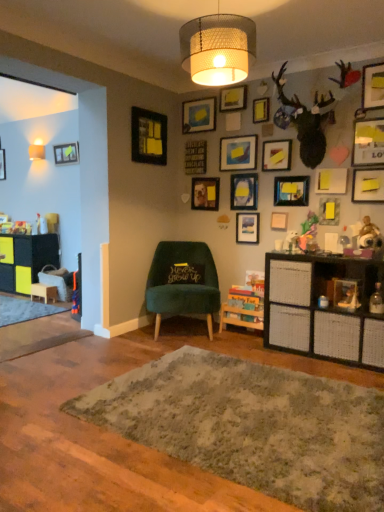
Question: Is textured gray rug at center far from matte wooden picture frame at center, placed as the 14th picture frame when sorted from right to left?

Choices:
 (A) yes
 (B) no

Answer: (A)

Question: Is matte wooden picture frame at center, which is the fourth picture frame in left-to-right order, a part of textured gray rug at center?

Choices:
 (A) yes
 (B) no

Answer: (B)

Question: From a real-world perspective, is textured gray rug at center below matte wooden picture frame at center, which is the fourth picture frame in left-to-right order?

Choices:
 (A) yes
 (B) no

Answer: (A)

Question: Is textured gray rug at center taller than matte wooden picture frame at center, which is the fourth picture frame in left-to-right order?

Choices:
 (A) no
 (B) yes

Answer: (A)

Question: From the image's perspective, is textured gray rug at center under matte wooden picture frame at center, placed as the 14th picture frame when sorted from right to left?

Choices:
 (A) yes
 (B) no

Answer: (A)

Question: Based on their positions, is yellow matte picture frame at upper right, the fifth picture frame in the right-to-left sequence, located to the left or right of matte black picture frame at upper center, the eleventh picture frame when ordered from left to right?

Choices:
 (A) right
 (B) left

Answer: (A)

Question: In terms of height, does yellow matte picture frame at upper right, marked as the 13th picture frame in a left-to-right arrangement, look taller or shorter compared to matte black picture frame at upper center, the 7th picture frame when ordered from right to left?

Choices:
 (A) tall
 (B) short

Answer: (A)

Question: From a real-world perspective, is yellow matte picture frame at upper right, marked as the 13th picture frame in a left-to-right arrangement, positioned above or below matte black picture frame at upper center, the 7th picture frame when ordered from right to left?

Choices:
 (A) above
 (B) below

Answer: (A)

Question: In terms of size, does yellow matte picture frame at upper right, the fifth picture frame in the right-to-left sequence, appear bigger or smaller than matte black picture frame at upper center, the 7th picture frame when ordered from right to left?

Choices:
 (A) small
 (B) big

Answer: (B)

Question: In terms of size, does velvet green chair at center appear bigger or smaller than matte black picture frame at upper center, marked as the sixteenth picture frame in a right-to-left arrangement?

Choices:
 (A) small
 (B) big

Answer: (B)

Question: Considering the positions of point (180, 247) and point (165, 160), is point (180, 247) closer or farther from the camera than point (165, 160)?

Choices:
 (A) farther
 (B) closer

Answer: (B)

Question: From the image's perspective, relative to matte black picture frame at upper center, marked as the sixteenth picture frame in a right-to-left arrangement, is velvet green chair at center above or below?

Choices:
 (A) above
 (B) below

Answer: (B)

Question: Looking at their shapes, would you say velvet green chair at center is wider or thinner than matte black picture frame at upper center, acting as the 2th picture frame starting from the left?

Choices:
 (A) wide
 (B) thin

Answer: (A)

Question: Looking at their shapes, would you say matte black picture frame at upper right, the 17th picture frame in the left-to-right sequence, is wider or thinner than yellow matte picture frame at upper right, which ranks as the 10th picture frame in left-to-right order?

Choices:
 (A) wide
 (B) thin

Answer: (A)

Question: Is point [x=369, y=136] closer or farther from the camera than point [x=276, y=154]?

Choices:
 (A) closer
 (B) farther

Answer: (A)